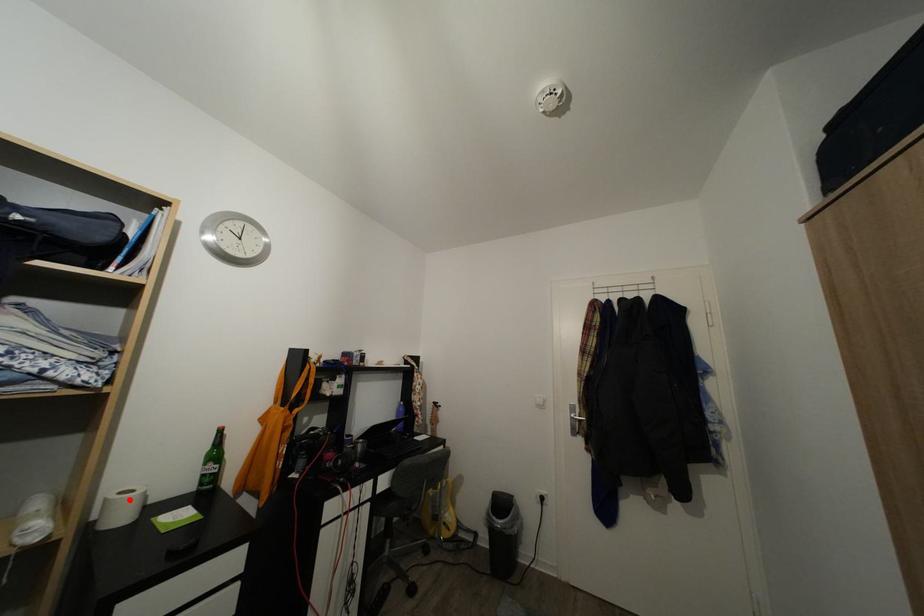
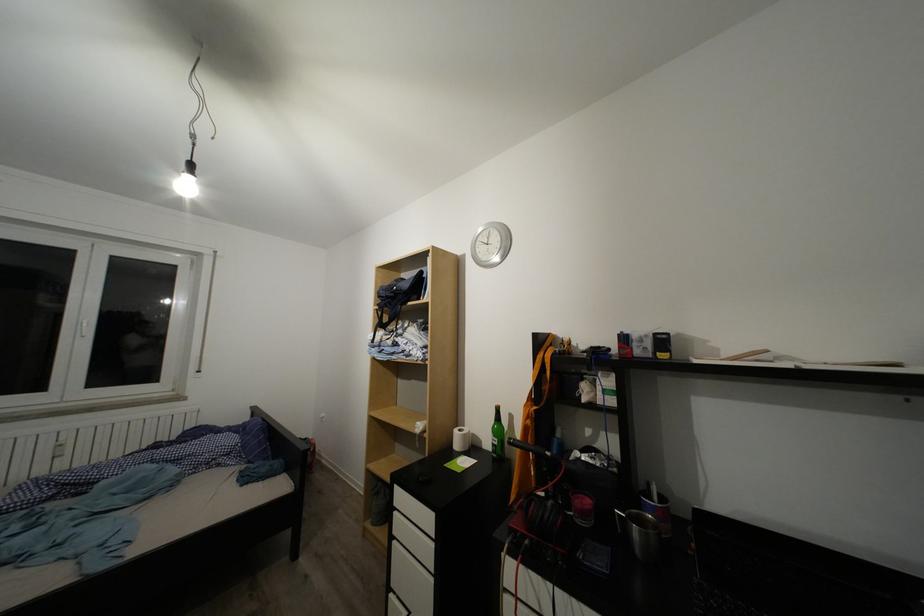
Question: I am providing you with two images of the same scene from different viewpoints. In image1, a red point is highlighted. Considering the same 3D point in image2, which of the following is correct?

Choices:
 (A) It is closer
 (B) It is farther

Answer: (B)